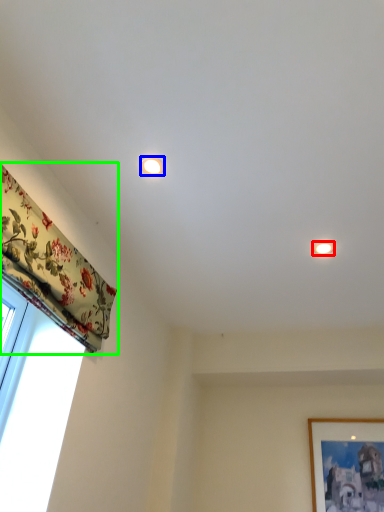
Question: Based on their relative distances, which object is nearer to lighting (highlighted by a red box)? Choose from lighting (highlighted by a blue box) and curtain (highlighted by a green box).

Choices:
 (A) lighting
 (B) curtain

Answer: (A)